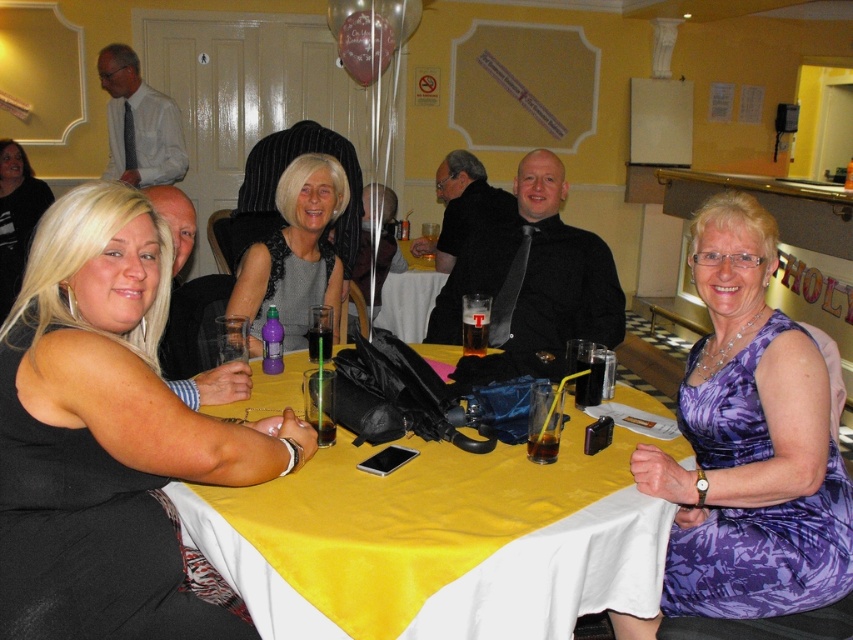
Can you confirm if yellow satin tablecloth at center is thinner than blonde hair at lower left?

No.

Is yellow satin tablecloth at center behind blonde hair at lower left?

That is False.

Image resolution: width=853 pixels, height=640 pixels. What do you see at coordinates (437, 541) in the screenshot?
I see `yellow satin tablecloth at center` at bounding box center [437, 541].

Where is `yellow satin tablecloth at center`? The image size is (853, 640). yellow satin tablecloth at center is located at coordinates (437, 541).

Which is in front, point (654, 540) or point (264, 289)?

Point (654, 540) is more forward.

Can you confirm if yellow satin tablecloth at center is taller than matte black dress at center?

Incorrect, yellow satin tablecloth at center's height is not larger of matte black dress at center's.

Which is behind, point (618, 480) or point (335, 308)?

Point (335, 308)

The image size is (853, 640). I want to click on yellow satin tablecloth at center, so click(x=437, y=541).

Find the location of a particular element. This screenshot has height=640, width=853. black satin dress at center is located at coordinates (106, 435).

Who is taller, black satin dress at center or blonde hair at lower left?

blonde hair at lower left

At what (x,y) coordinates should I click in order to perform the action: click on black satin dress at center. Please return your answer as a coordinate pair (x, y). Image resolution: width=853 pixels, height=640 pixels. Looking at the image, I should click on (106, 435).